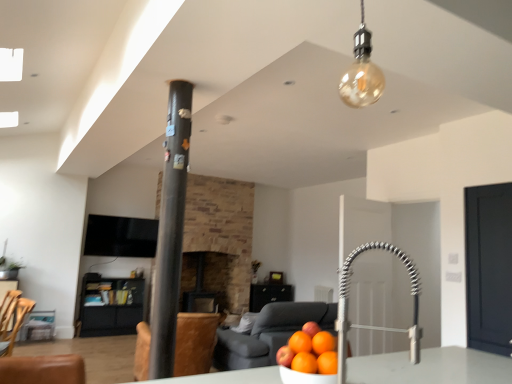
Question: Is dark brown stone fireplace at center far away from black textured pillar at center?

Choices:
 (A) no
 (B) yes

Answer: (B)

Question: Is dark brown stone fireplace at center looking in the opposite direction of black textured pillar at center?

Choices:
 (A) yes
 (B) no

Answer: (B)

Question: From the image's perspective, is dark brown stone fireplace at center beneath black textured pillar at center?

Choices:
 (A) no
 (B) yes

Answer: (B)

Question: Is black textured pillar at center located within dark brown stone fireplace at center?

Choices:
 (A) yes
 (B) no

Answer: (B)

Question: Is dark brown stone fireplace at center positioned behind black textured pillar at center?

Choices:
 (A) yes
 (B) no

Answer: (A)

Question: Does dark brown stone fireplace at center have a greater height compared to black textured pillar at center?

Choices:
 (A) yes
 (B) no

Answer: (B)

Question: Are dark matte door at right and black matte cabinet at lower left far apart?

Choices:
 (A) yes
 (B) no

Answer: (A)

Question: Is dark matte door at right facing away from black matte cabinet at lower left?

Choices:
 (A) no
 (B) yes

Answer: (A)

Question: From a real-world perspective, is dark matte door at right located higher than black matte cabinet at lower left?

Choices:
 (A) no
 (B) yes

Answer: (B)

Question: Does dark matte door at right have a greater width compared to black matte cabinet at lower left?

Choices:
 (A) yes
 (B) no

Answer: (B)

Question: Is dark matte door at right bigger than black matte cabinet at lower left?

Choices:
 (A) no
 (B) yes

Answer: (A)

Question: Is dark matte door at right completely or partially outside of black matte cabinet at lower left?

Choices:
 (A) no
 (B) yes

Answer: (B)

Question: Does amber glass bulb at upper center have a larger size compared to brown leather swivel chair at center, which is counted as the 2th swivel chair, starting from the front?

Choices:
 (A) yes
 (B) no

Answer: (B)